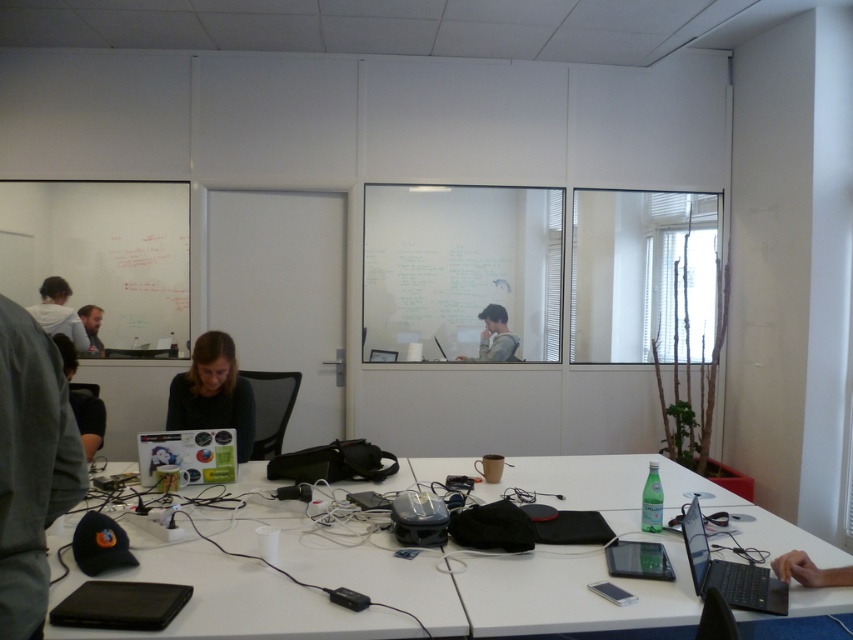
Which of these two, dark gray fabric shirt at left or matte black laptop at center, stands shorter?

Standing shorter between the two is matte black laptop at center.

Between dark gray fabric shirt at left and matte black laptop at center, which one has more height?

dark gray fabric shirt at left is taller.

Identify the location of dark gray fabric shirt at left. The width and height of the screenshot is (853, 640). (88, 419).

Is whiteboard at center to the left of matte black laptop at lower left from the viewer's perspective?

In fact, whiteboard at center is to the right of matte black laptop at lower left.

Can you confirm if whiteboard at center is bigger than matte black laptop at lower left?

Indeed, whiteboard at center has a larger size compared to matte black laptop at lower left.

This screenshot has height=640, width=853. Describe the element at coordinates (460, 273) in the screenshot. I see `whiteboard at center` at that location.

Identify the location of whiteboard at center. This screenshot has width=853, height=640. (460, 273).

Which is in front, point (80, 204) or point (91, 333)?

Positioned in front is point (80, 204).

Measure the distance between whiteboard at upper left and camera.

whiteboard at upper left and camera are 4.42 meters apart from each other.

Is point (113, 220) in front of point (90, 344)?

No, it is behind (90, 344).

Image resolution: width=853 pixels, height=640 pixels. I want to click on whiteboard at upper left, so click(102, 252).